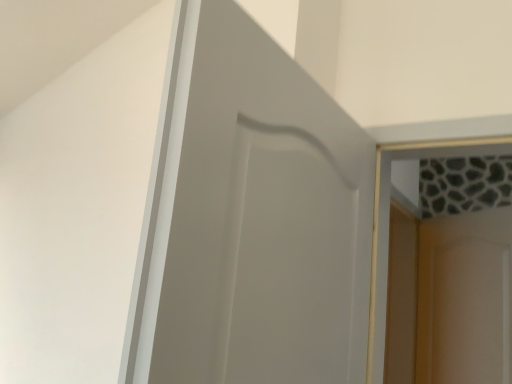
Question: In the image, is matte white door at center on the left side or the right side of white glossy screen door at upper right?

Choices:
 (A) right
 (B) left

Answer: (B)

Question: From the image's perspective, is matte white door at center located above or below white glossy screen door at upper right?

Choices:
 (A) above
 (B) below

Answer: (A)

Question: Considering their positions, is matte white door at center located in front of or behind white glossy screen door at upper right?

Choices:
 (A) front
 (B) behind

Answer: (A)

Question: In the image, is white glossy screen door at upper right positioned in front of or behind matte white door at center?

Choices:
 (A) front
 (B) behind

Answer: (B)

Question: Considering the positions of white glossy screen door at upper right and matte white door at center in the image, is white glossy screen door at upper right bigger or smaller than matte white door at center?

Choices:
 (A) small
 (B) big

Answer: (A)

Question: Considering the positions of point (499, 359) and point (153, 196), is point (499, 359) closer or farther from the camera than point (153, 196)?

Choices:
 (A) farther
 (B) closer

Answer: (A)

Question: From a real-world perspective, is white glossy screen door at upper right positioned above or below matte white door at center?

Choices:
 (A) below
 (B) above

Answer: (A)